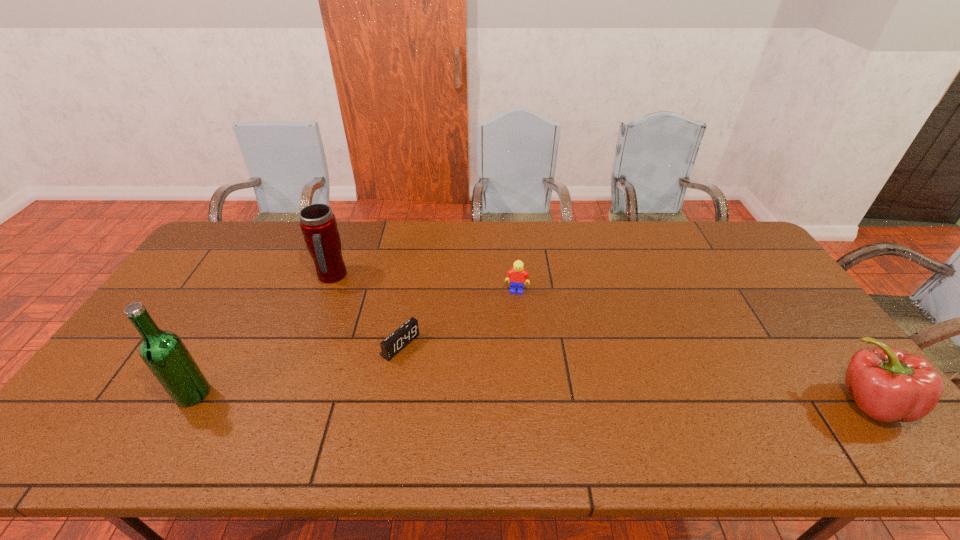
What are the coordinates of `free point at the far right corner` in the screenshot? It's located at (698, 227).

What are the coordinates of `vacant point located between the third object from left to right and the tallest object` in the screenshot? It's located at (297, 369).

Where is `empty space that is in between the leftmost object and the fourth object from left to right`? Image resolution: width=960 pixels, height=540 pixels. empty space that is in between the leftmost object and the fourth object from left to right is located at coordinates (355, 342).

The height and width of the screenshot is (540, 960). In order to click on empty location between the beer bottle and the second object from left to right in this screenshot , I will do `click(262, 335)`.

The height and width of the screenshot is (540, 960). I want to click on free spot between the fourth tallest object and the fourth object from right to left, so click(x=424, y=284).

What are the coordinates of `free space that is in between the fourth object from right to left and the Lego` in the screenshot? It's located at (424, 284).

Find the location of a particular element. free space between the alarm clock and the second shortest object is located at coordinates (459, 318).

This screenshot has width=960, height=540. Identify the location of vacant area that lies between the rightmost object and the fourth object from right to left. (601, 340).

Locate an element on the screen. empty location between the leftmost object and the third shortest object is located at coordinates tap(532, 398).

Find the location of a particular element. Image resolution: width=960 pixels, height=540 pixels. free space between the beer bottle and the alarm clock is located at coordinates (297, 369).